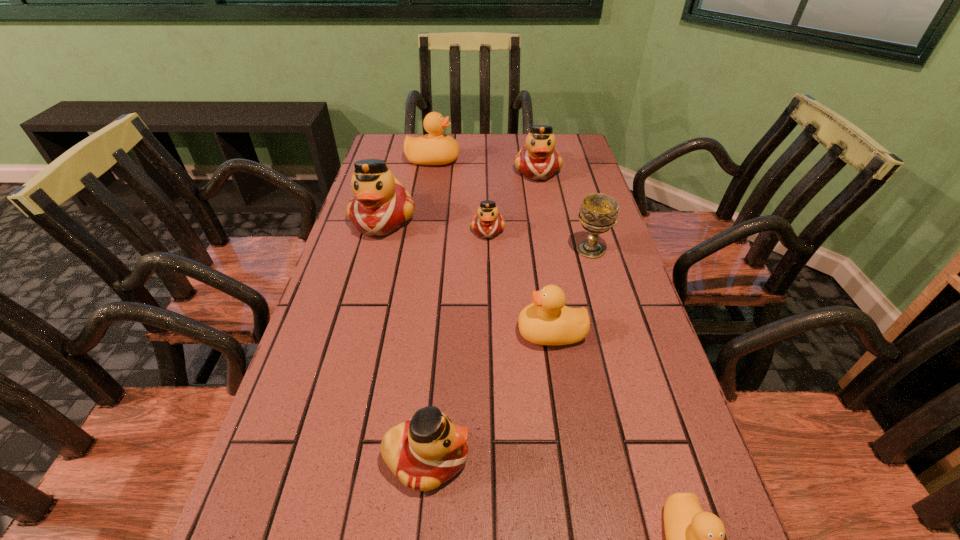
I want to click on free spot between the smallest red duck and the nearest red duck, so click(457, 344).

You are a GUI agent. You are given a task and a screenshot of the screen. Output one action in this format:
    pyautogui.click(x=<x>, y=<y>)
    Task: Click on the free space between the third smallest red duck and the smallest red duck
    The image size is (960, 540).
    Given the screenshot: What is the action you would take?
    pyautogui.click(x=513, y=200)

Locate an element on the screen. This screenshot has height=540, width=960. vacant area that lies between the farthest yellow duck and the smallest red duck is located at coordinates (461, 195).

The image size is (960, 540). Identify the location of free space that is in between the third nearest object and the leftmost yellow duck. (492, 246).

This screenshot has height=540, width=960. Identify the location of object that can be found as the fourth closest to the nearest yellow duck. (487, 223).

Locate which object is the closest to the leftmost red duck. Please provide its 2D coordinates. Your answer should be formatted as a tuple, i.e. [(x, y)], where the tuple contains the x and y coordinates of a point satisfying the conditions above.

[(487, 223)]

You are a GUI agent. You are given a task and a screenshot of the screen. Output one action in this format:
    pyautogui.click(x=<x>, y=<y>)
    Task: Click on the duck that stands as the fourth closest to the smallest red duck
    Image resolution: width=960 pixels, height=540 pixels.
    Given the screenshot: What is the action you would take?
    click(435, 148)

Find the location of a particular element. This screenshot has height=540, width=960. duck identified as the closest to the nearest yellow duck is located at coordinates (427, 450).

Select which red duck is the closest to the farthest red duck. Please provide its 2D coordinates. Your answer should be formatted as a tuple, i.e. [(x, y)], where the tuple contains the x and y coordinates of a point satisfying the conditions above.

[(487, 223)]

Where is `red duck object that ranks as the third closest to the white chalice`? red duck object that ranks as the third closest to the white chalice is located at coordinates (380, 205).